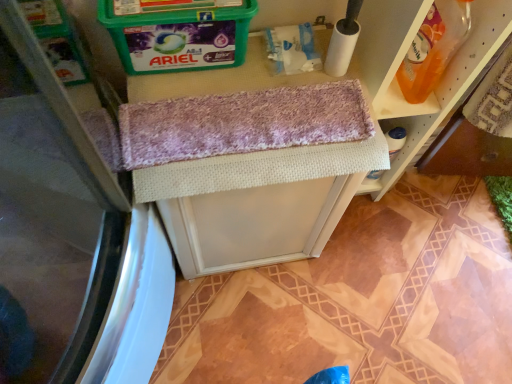
In order to click on vacant area that is situated to the right of woven fabric vanity at center in this screenshot , I will do `click(368, 261)`.